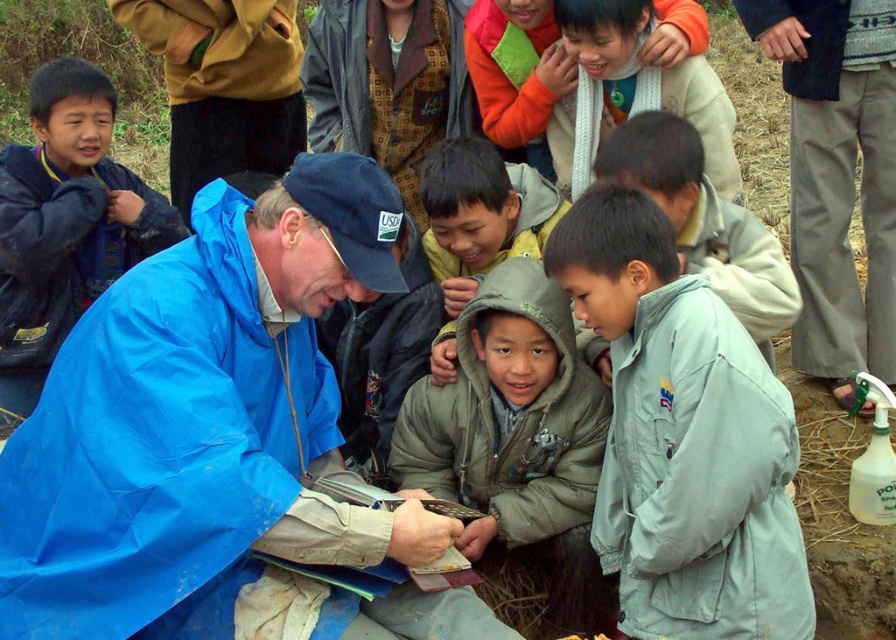
Question: Which point is closer to the camera taking this photo?

Choices:
 (A) (419, 550)
 (B) (48, 304)

Answer: (A)

Question: Considering the relative positions of blue waterproof jacket at left and orange fleece jacket at upper center in the image provided, where is blue waterproof jacket at left located with respect to orange fleece jacket at upper center?

Choices:
 (A) right
 (B) left

Answer: (B)

Question: Is matte black jacket at left closer to camera compared to blue waterproof jacket at left?

Choices:
 (A) yes
 (B) no

Answer: (A)

Question: Based on their relative distances, which object is nearer to the blue waterproof jacket at center?

Choices:
 (A) light gray hooded jacket at center
 (B) matte black jacket at left
 (C) orange fleece jacket at upper center
 (D) light gray fabric jacket at center

Answer: (D)

Question: Among these points, which one is nearest to the camera?

Choices:
 (A) (642, 636)
 (B) (501, 193)
 (C) (712, 273)

Answer: (A)

Question: Can you confirm if blue waterproof jacket at left is positioned below gray matte jacket at center?

Choices:
 (A) yes
 (B) no

Answer: (B)